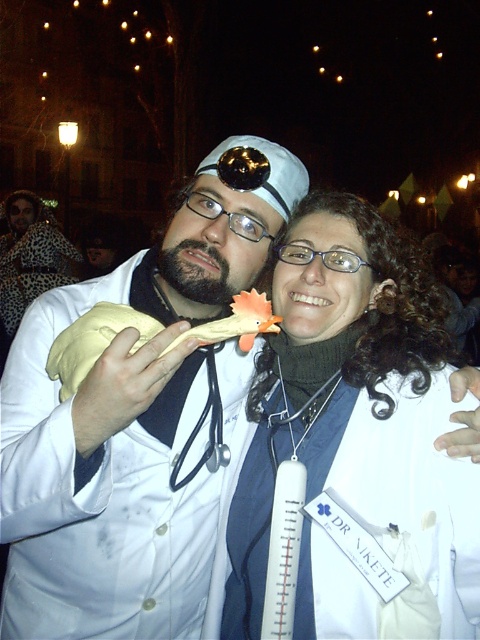
Can you confirm if white fabric thermometer at center is positioned below yellow fabric toy at center?

Yes.

How far apart are white fabric thermometer at center and yellow fabric toy at center?

white fabric thermometer at center is 21.44 inches from yellow fabric toy at center.

This screenshot has width=480, height=640. I want to click on white fabric thermometer at center, so click(338, 384).

Can you confirm if white fabric thermometer at center is positioned to the right of black rubber stethoscope at center?

Indeed, white fabric thermometer at center is positioned on the right side of black rubber stethoscope at center.

I want to click on white fabric thermometer at center, so click(338, 384).

Which of these two, yellow fabric toy at center or black rubber stethoscope at center, stands taller?

Standing taller between the two is black rubber stethoscope at center.

I want to click on yellow fabric toy at center, so click(94, 340).

Describe the element at coordinates (94, 340) in the screenshot. I see `yellow fabric toy at center` at that location.

Identify the location of yellow fabric toy at center. Image resolution: width=480 pixels, height=640 pixels. (94, 340).